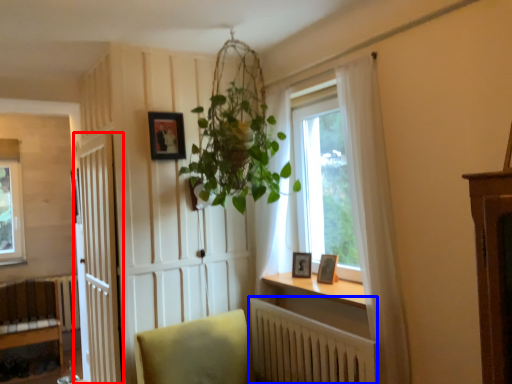
Question: Which point is closer to the camera, door (highlighted by a red box) or radiator (highlighted by a blue box)?

Choices:
 (A) door
 (B) radiator

Answer: (B)